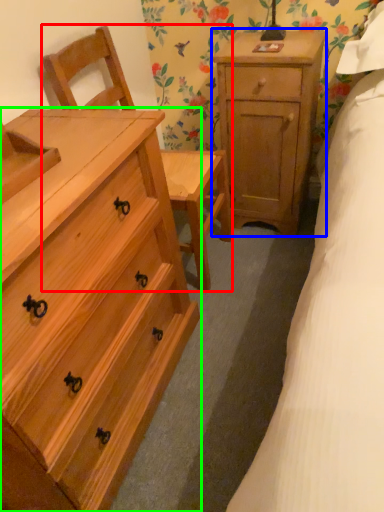
Question: Which object is positioned farthest from armchair (highlighted by a red box)? Select from nightstand (highlighted by a blue box) and chest of drawers (highlighted by a green box).

Choices:
 (A) nightstand
 (B) chest of drawers

Answer: (B)